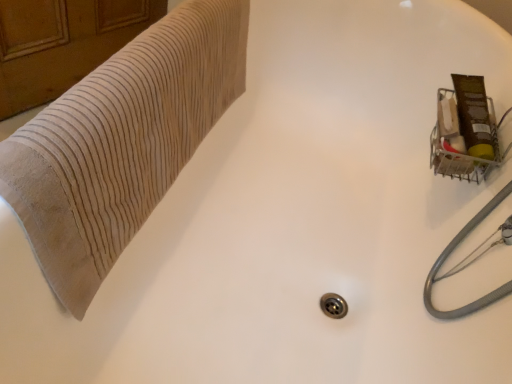
In order to face gray textured towel at upper left, should I rotate leftwards or rightwards?

You should rotate left by 14.194 degrees.

Measure the distance between gray textured towel at upper left and camera.

gray textured towel at upper left and camera are 17.43 inches apart from each other.

Locate an element on the screen. gray textured towel at upper left is located at coordinates [121, 142].

Describe the element at coordinates (121, 142) in the screenshot. I see `gray textured towel at upper left` at that location.

This screenshot has height=384, width=512. What are the coordinates of `gray textured towel at upper left` in the screenshot? It's located at (121, 142).